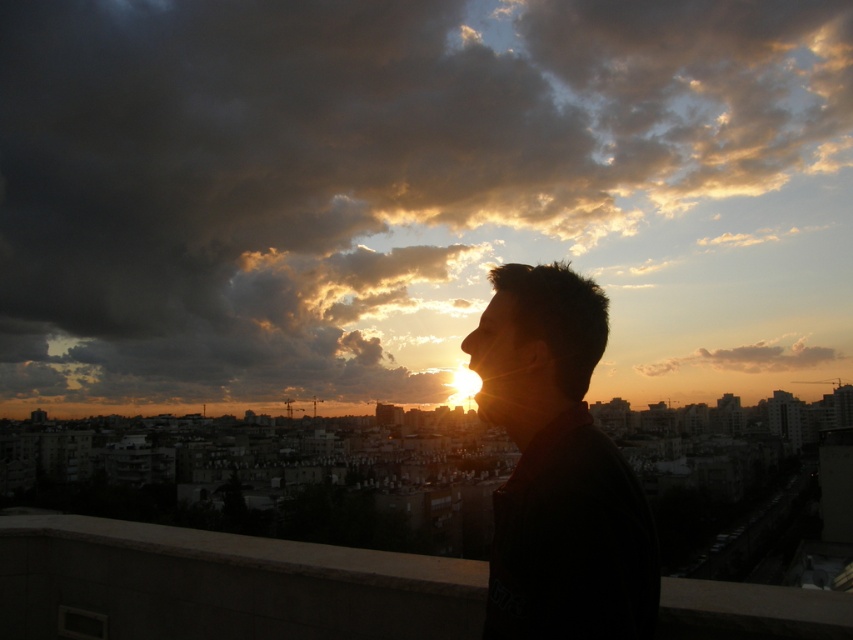
You are a drone operator trying to navigate between two points in the city. The first point is point (196, 627) and the second is point (759, 349). According to the scene, which point is closer to the observer?

Point (196, 627) is in front of point (759, 349), so it is closer to the observer.

You are a drone operator who needs to capture a photo of the silhouette hair at center from directly above. Given that your drone can only fly up to 150 feet high, will you be able to position it high enough to get a clear overhead shot?

The distance between the silhouette hair at center and the viewer is 166.40 feet. Since the drone can only fly up to 150 feet, it won